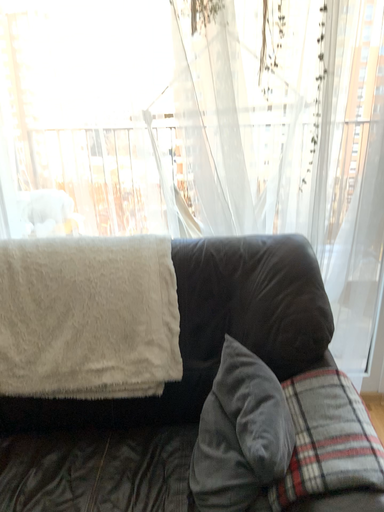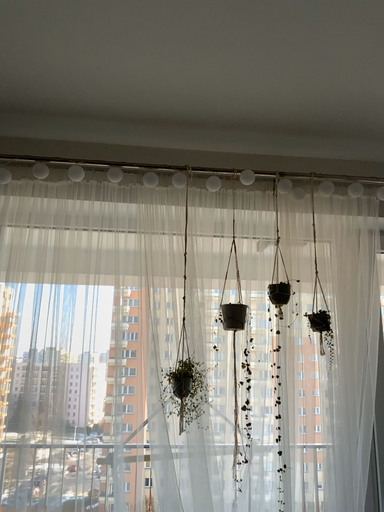
Question: How did the camera likely rotate when shooting the video?

Choices:
 (A) rotated right
 (B) rotated left

Answer: (A)